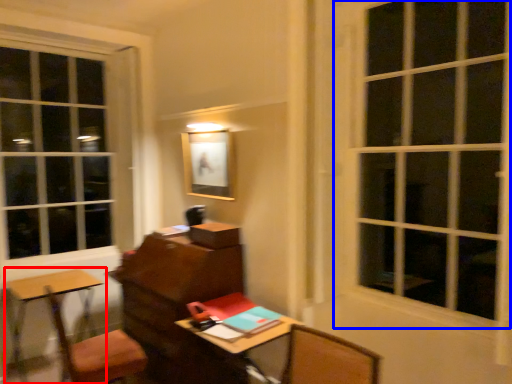
Question: Among these objects, which one is nearest to the camera, table (highlighted by a red box) or window (highlighted by a blue box)?

Choices:
 (A) table
 (B) window

Answer: (B)